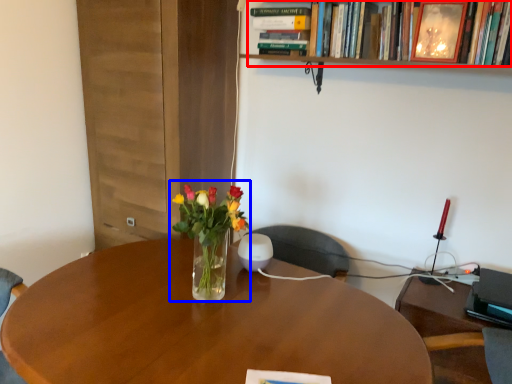
Question: Which point is closer to the camera, book (highlighted by a red box) or floral arrangement (highlighted by a blue box)?

Choices:
 (A) book
 (B) floral arrangement

Answer: (B)